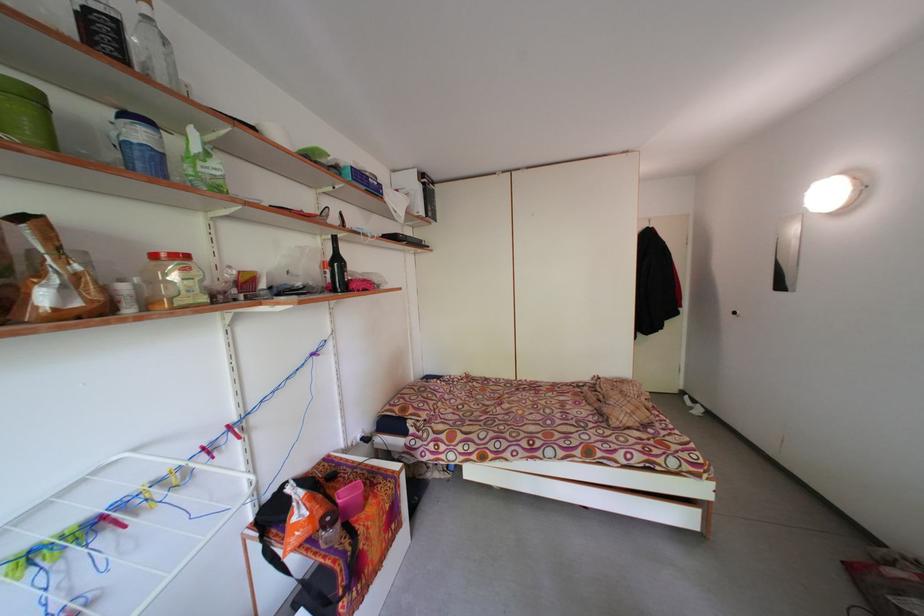
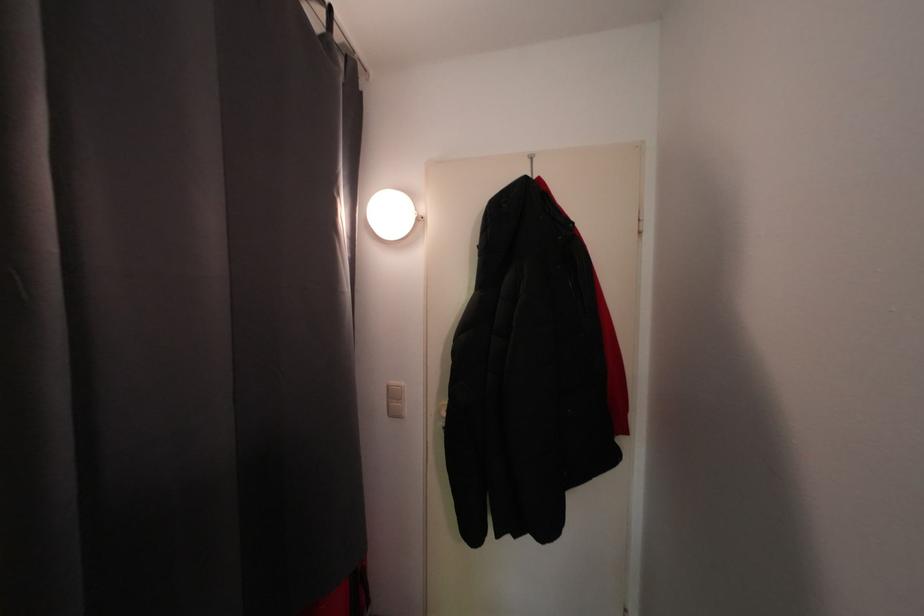
What movement of the cameraman would produce the second image?

The movement direction of the cameraman is right, forward.